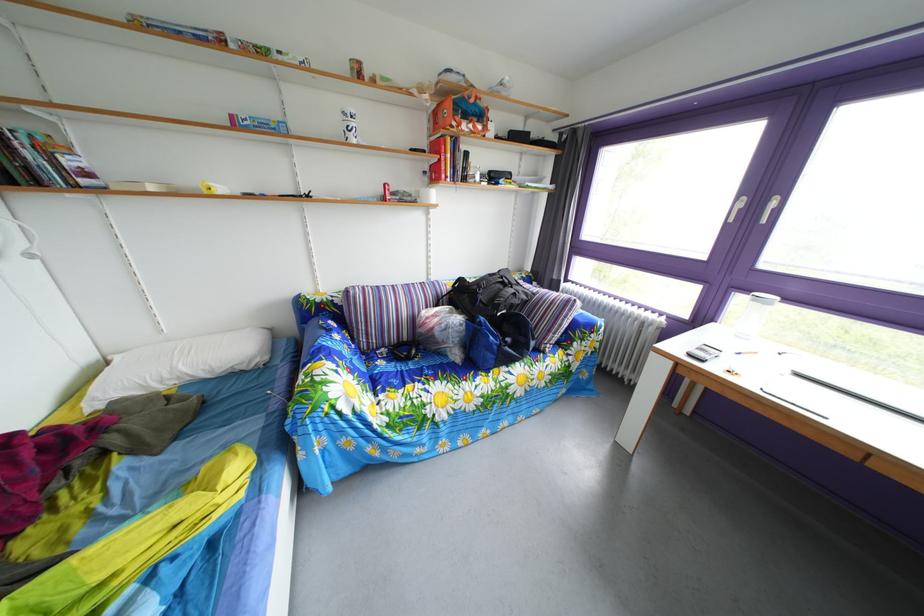
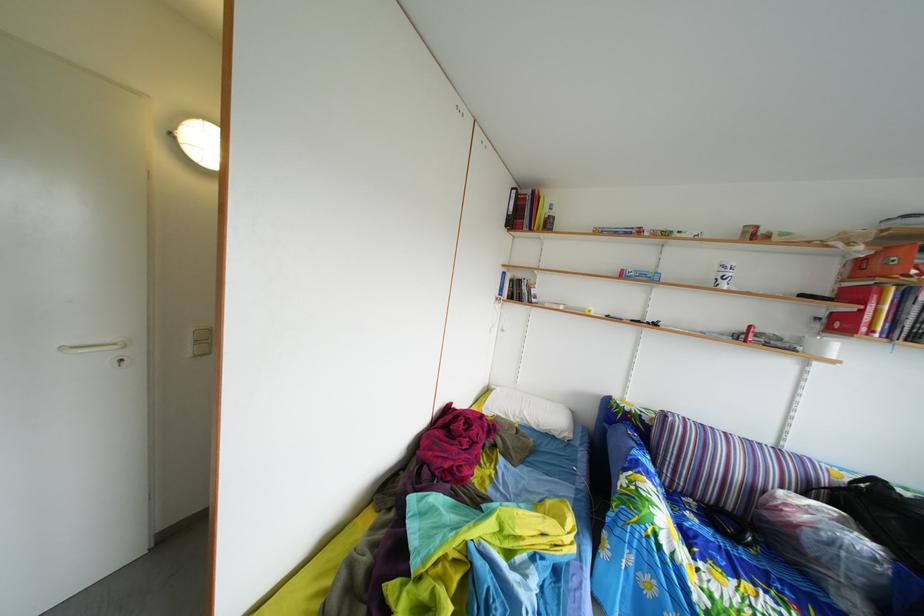
Where in the second image is the point corresponding to (416,347) from the first image?

(739, 516)